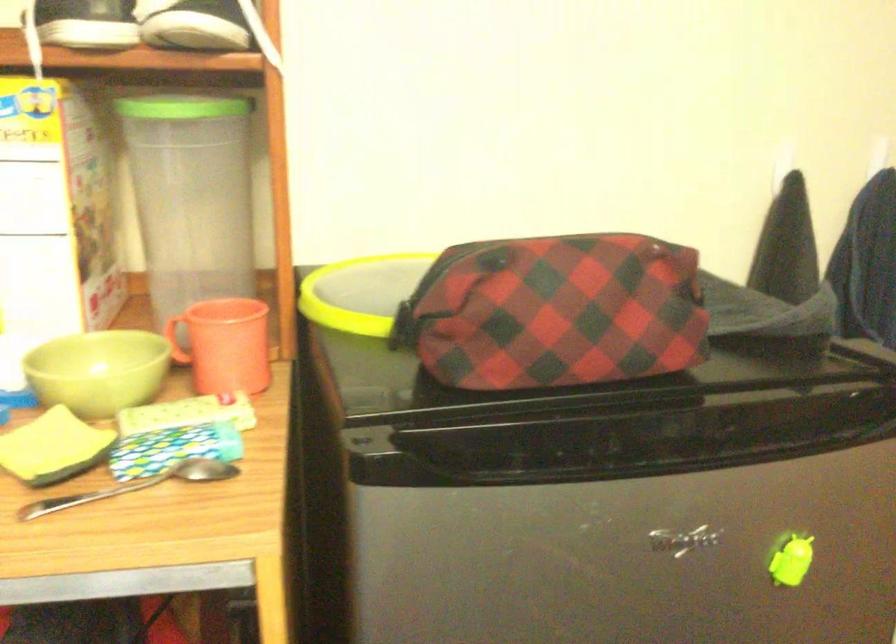
Describe the element at coordinates (362, 292) in the screenshot. I see `a yellow container lid` at that location.